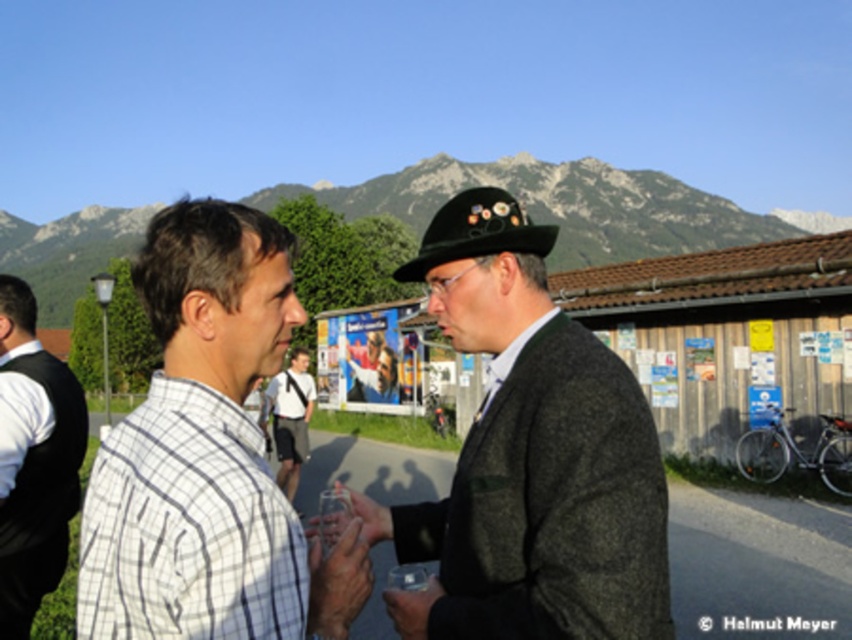
You are a photographer standing at the center of the scene. You want to take a group photo of the white shirt at left and the white cotton shirt at center. What is the minimum distance you need to move forward to ensure both subjects are in frame?

The white shirt at left and white cotton shirt at center are 8.84 meters apart. To capture both in the frame, the photographer must position themselves far enough back so that the camera can encompass the 8.84 meter distance between them. The exact distance depends on the camera lens and sensor size, but the minimum forward movement would require the photographer to be at least half the distance between them, so moving forward 4.42 meters from the center might not be sufficient. However, without specific l

From the picture: You are standing at a distance of 10 meters from the white checkered shirt at left. Can you see the white cotton shirt at center from your current position?

The white checkered shirt at left is 13.31 meters away from the white cotton shirt at center. Since you are only 10 meters away from the white checkered shirt at left, you are still within the 13.31 meters distance between them, so you can see the white cotton shirt at center.